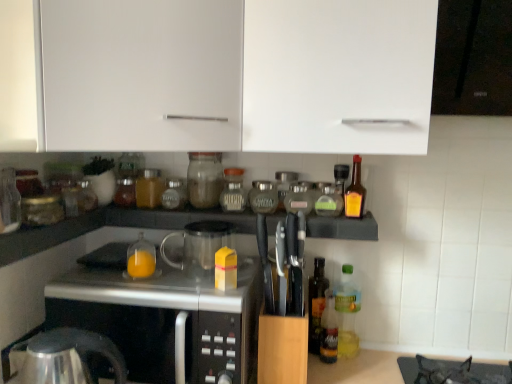
Question: From a real-world perspective, is shiny metallic kettle at lower left beneath clear glass jar at left, the 11th bottle positioned from the right?

Choices:
 (A) no
 (B) yes

Answer: (B)

Question: Is shiny metallic kettle at lower left aimed at clear glass jar at left, the 11th bottle positioned from the right?

Choices:
 (A) no
 (B) yes

Answer: (A)

Question: Can you confirm if shiny metallic kettle at lower left is positioned to the right of clear glass jar at left, the 11th bottle positioned from the right?

Choices:
 (A) yes
 (B) no

Answer: (A)

Question: Is shiny metallic kettle at lower left not within clear glass jar at left, the 11th bottle positioned from the right?

Choices:
 (A) yes
 (B) no

Answer: (A)

Question: Is shiny metallic kettle at lower left to the left of clear glass jar at left, positioned as the 2th bottle in left-to-right order, from the viewer's perspective?

Choices:
 (A) no
 (B) yes

Answer: (A)

Question: Considering the relative sizes of shiny metallic kettle at lower left and clear glass jar at left, positioned as the 2th bottle in left-to-right order, in the image provided, is shiny metallic kettle at lower left wider than clear glass jar at left, positioned as the 2th bottle in left-to-right order,?

Choices:
 (A) yes
 (B) no

Answer: (A)

Question: Does white matte cabinet at upper center, which ranks as the 1th cabinetry in left-to-right order, have a greater width compared to brown glass jar at center, which is the 3th bottle from left to right?

Choices:
 (A) no
 (B) yes

Answer: (B)

Question: Is white matte cabinet at upper center, which ranks as the 1th cabinetry in left-to-right order, thinner than brown glass jar at center, the tenth bottle positioned from the right?

Choices:
 (A) yes
 (B) no

Answer: (B)

Question: Is white matte cabinet at upper center, which ranks as the 1th cabinetry in left-to-right order, to the left of brown glass jar at center, which is the 3th bottle from left to right, from the viewer's perspective?

Choices:
 (A) no
 (B) yes

Answer: (B)

Question: Is white matte cabinet at upper center, which ranks as the 1th cabinetry in left-to-right order, positioned in front of brown glass jar at center, the tenth bottle positioned from the right?

Choices:
 (A) yes
 (B) no

Answer: (A)

Question: Is white matte cabinet at upper center, which ranks as the 1th cabinetry in left-to-right order, further to camera compared to brown glass jar at center, the tenth bottle positioned from the right?

Choices:
 (A) no
 (B) yes

Answer: (A)

Question: Considering the relative positions of white matte cabinet at upper center, which ranks as the 1th cabinetry in left-to-right order, and brown glass jar at center, the tenth bottle positioned from the right, in the image provided, is white matte cabinet at upper center, which ranks as the 1th cabinetry in left-to-right order, to the right of brown glass jar at center, the tenth bottle positioned from the right, from the viewer's perspective?

Choices:
 (A) no
 (B) yes

Answer: (A)

Question: From the image's perspective, would you say amber glass bottle at right, arranged as the twelfth bottle when viewed from the left, is positioned over green glass bottle at center, placed as the 9th bottle when sorted from left to right?

Choices:
 (A) no
 (B) yes

Answer: (B)